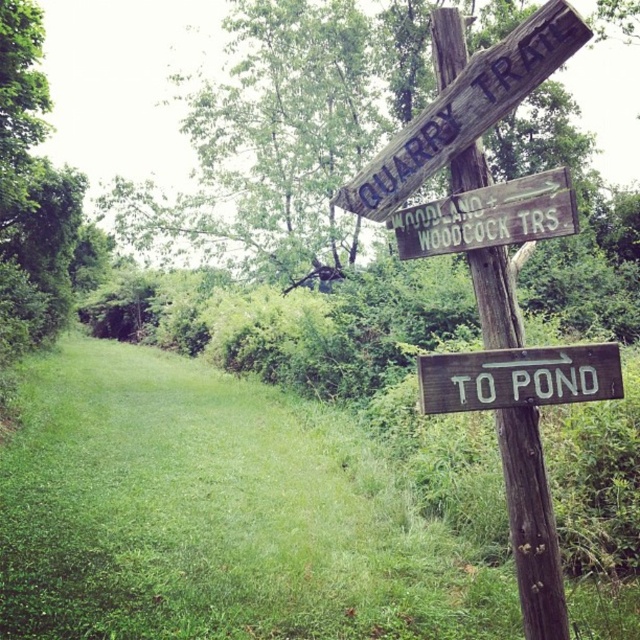
Question: Is weathered wood sign at upper center to the right of wooden sign at lower right from the viewer's perspective?

Choices:
 (A) no
 (B) yes

Answer: (A)

Question: Which object is the farthest from the wooden sign at lower right?

Choices:
 (A) weathered wood sign at upper center
 (B) wooden signpost at right
 (C) wooden signpost at upper center

Answer: (A)

Question: Does weathered wood sign at upper center have a lesser width compared to wooden signpost at upper center?

Choices:
 (A) no
 (B) yes

Answer: (A)

Question: Observing the image, what is the correct spatial positioning of wooden signpost at right in reference to wooden signpost at upper center?

Choices:
 (A) left
 (B) right

Answer: (B)

Question: Estimate the real-world distances between objects in this image. Which object is farther from the wooden sign at lower right?

Choices:
 (A) wooden signpost at right
 (B) wooden signpost at upper center
 (C) weathered wood sign at upper center

Answer: (C)

Question: Which of the following is the farthest from the observer?

Choices:
 (A) wooden signpost at upper center
 (B) weathered wood sign at upper center

Answer: (A)